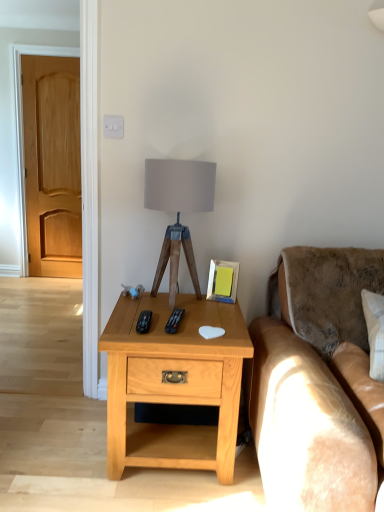
Question: From the image's perspective, relative to black plastic remote at center, the 1th remote viewed from the left, is metallic silver picture frame at upper right above or below?

Choices:
 (A) below
 (B) above

Answer: (B)

Question: From a real-world perspective, relative to black plastic remote at center, the 2th remote viewed from the right, is metallic silver picture frame at upper right vertically above or below?

Choices:
 (A) below
 (B) above

Answer: (B)

Question: Considering the real-world distances, which object is closest to the light brown wood door at left?

Choices:
 (A) light wood/texturedesk at center
 (B) black plastic remote at center, the 1th remote positioned from the right
 (C) black plastic remote at center, the 1th remote viewed from the left
 (D) metallic silver picture frame at upper right
 (E) brown plush couch at right

Answer: (D)

Question: Which object is the farthest from the light brown wood door at left?

Choices:
 (A) light wood/texturedesk at center
 (B) brown plush couch at right
 (C) black plastic remote at center, the 2th remote viewed from the right
 (D) black plastic remote at center, the 1th remote positioned from the right
 (E) matte gray fabric at center

Answer: (B)